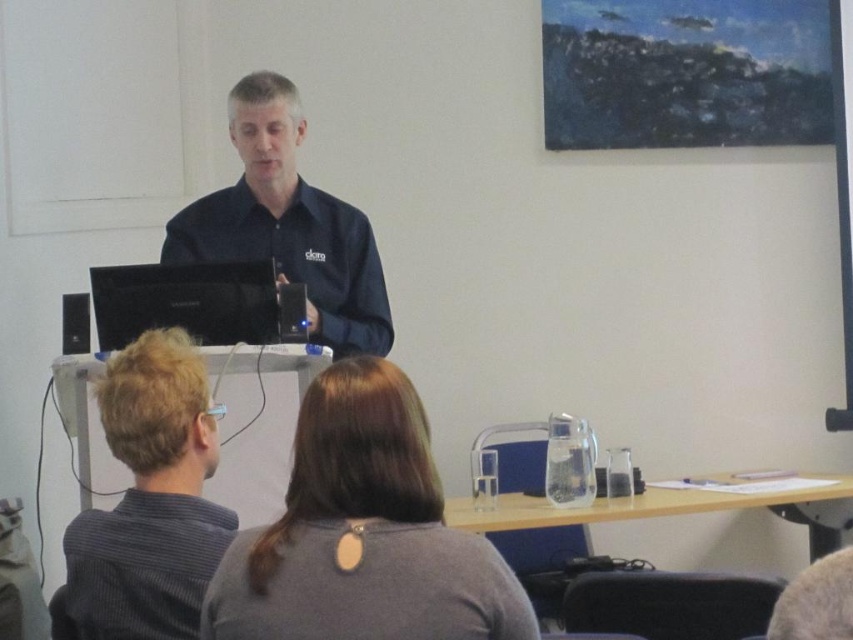
Can you confirm if gray fabric shirt at center is wider than black glossy laptop at center?

No, gray fabric shirt at center is not wider than black glossy laptop at center.

Between point (463, 552) and point (219, 337), which one is positioned in front?

Point (463, 552)

Where is `gray fabric shirt at center`? This screenshot has height=640, width=853. gray fabric shirt at center is located at coordinates (363, 532).

Can you confirm if gray striped shirt at lower left is shorter than black glossy laptop at center?

Result: Incorrect, gray striped shirt at lower left's height does not fall short of black glossy laptop at center's.

Who is positioned more to the right, gray striped shirt at lower left or black glossy laptop at center?

gray striped shirt at lower left is more to the right.

Is point (132, 589) positioned before point (177, 266)?

That is True.

Identify the location of gray striped shirt at lower left. This screenshot has width=853, height=640. (148, 502).

Is point (126, 269) farther from viewer compared to point (64, 298)?

That is False.

The image size is (853, 640). What do you see at coordinates (192, 301) in the screenshot?
I see `black glossy laptop at center` at bounding box center [192, 301].

Is point (193, 310) farther from camera compared to point (62, 305)?

No, it is in front of (62, 305).

Find the location of a particular element. This screenshot has height=640, width=853. black glossy laptop at center is located at coordinates (192, 301).